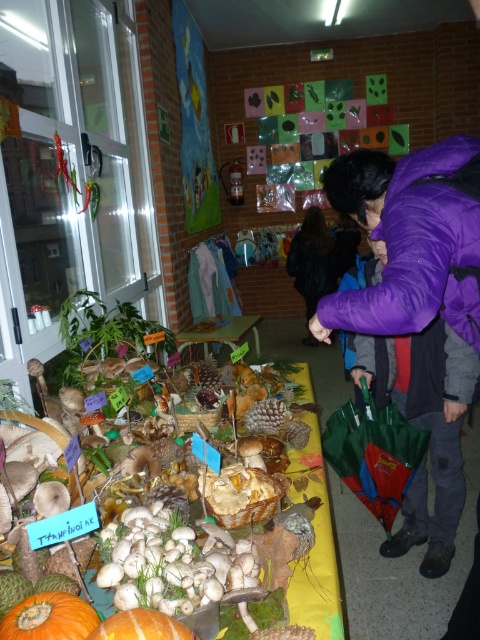
Question: Which point is closer to the camera?

Choices:
 (A) white matte mushrooms at center
 (B) wooden table at center
 (C) purple fleece jacket at upper right
 (D) black fabric at center

Answer: (A)

Question: Does purple fleece jacket at upper right appear on the right side of white matte mushrooms at center?

Choices:
 (A) no
 (B) yes

Answer: (B)

Question: Is orange matte pumpkin at lower left to the left of wooden table at center from the viewer's perspective?

Choices:
 (A) no
 (B) yes

Answer: (B)

Question: Which point is farther from the camera taking this photo?

Choices:
 (A) (237, 317)
 (B) (81, 627)
 (C) (423, 372)

Answer: (A)

Question: Does white matte mushrooms at center appear under black fabric at center?

Choices:
 (A) no
 (B) yes

Answer: (B)

Question: Which point is farther to the camera?

Choices:
 (A) orange matte pumpkin at lower left
 (B) wooden table at center
 (C) green leafy vegetable at left

Answer: (B)